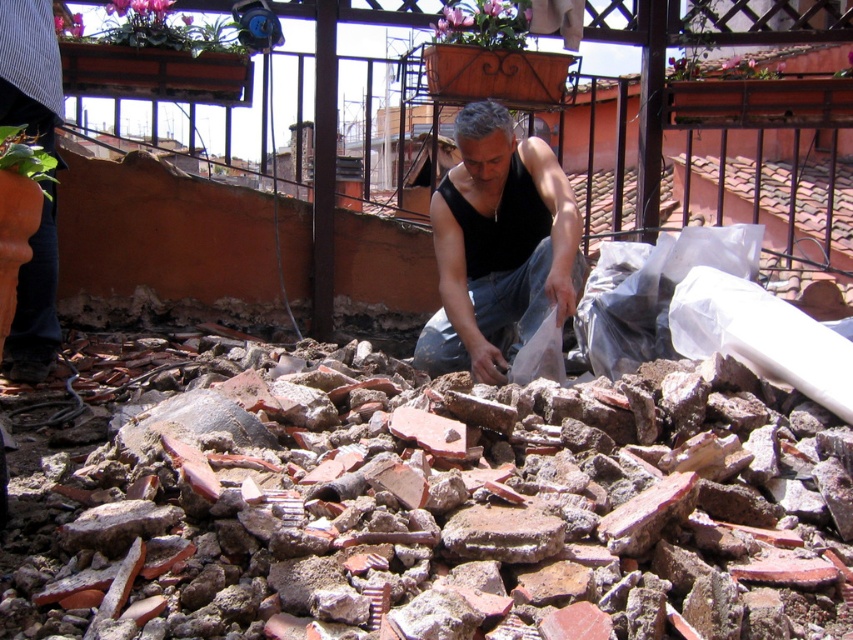
Question: Does brick rubble at center appear over black matte vest at center?

Choices:
 (A) no
 (B) yes

Answer: (A)

Question: Among these objects, which one is nearest to the camera?

Choices:
 (A) brick rubble at center
 (B) black matte vest at center

Answer: (A)

Question: Does brick rubble at center appear under black matte vest at center?

Choices:
 (A) yes
 (B) no

Answer: (A)

Question: Can you confirm if brick rubble at center is positioned to the left of black matte vest at center?

Choices:
 (A) yes
 (B) no

Answer: (A)